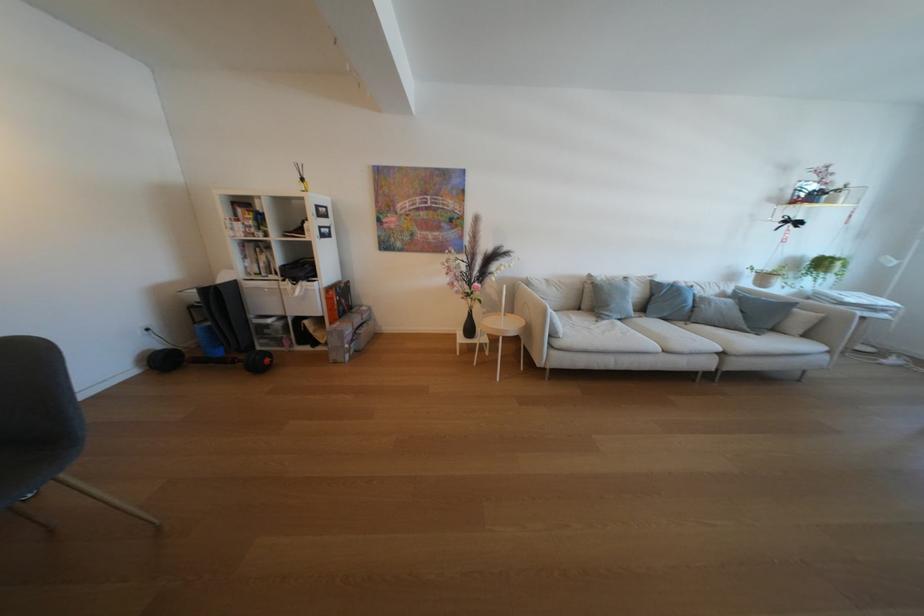
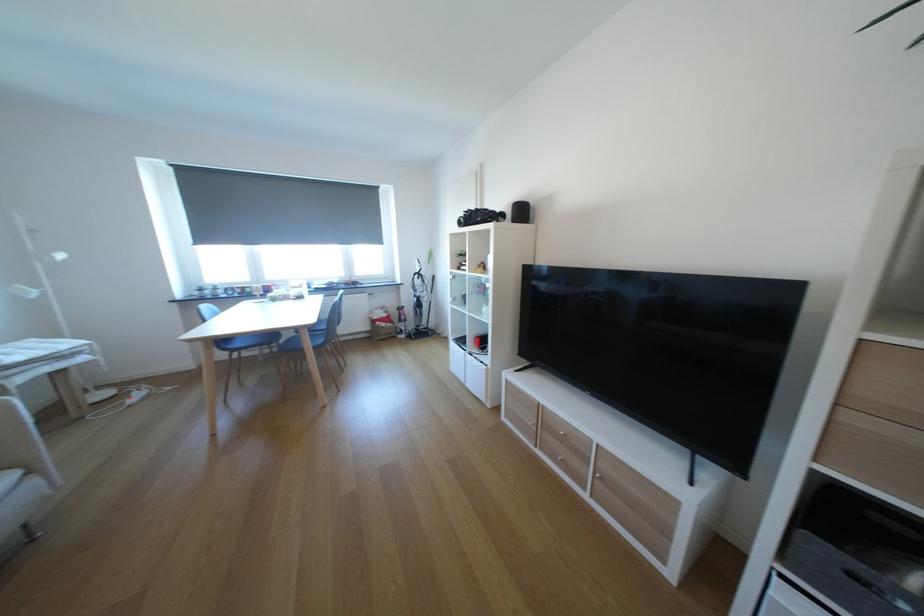
In the second image, find the point that corresponds to point 834,349 in the first image.

(21, 477)